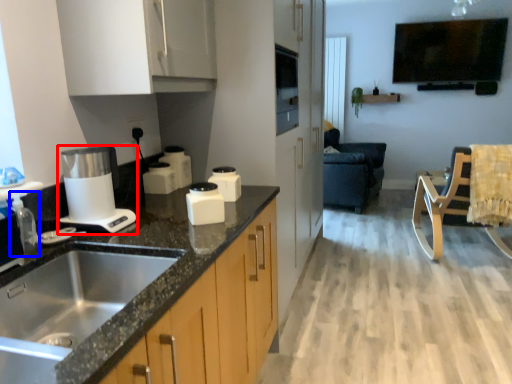
Question: Which point is further to the camera, home appliance (highlighted by a red box) or faucet (highlighted by a blue box)?

Choices:
 (A) home appliance
 (B) faucet

Answer: (A)